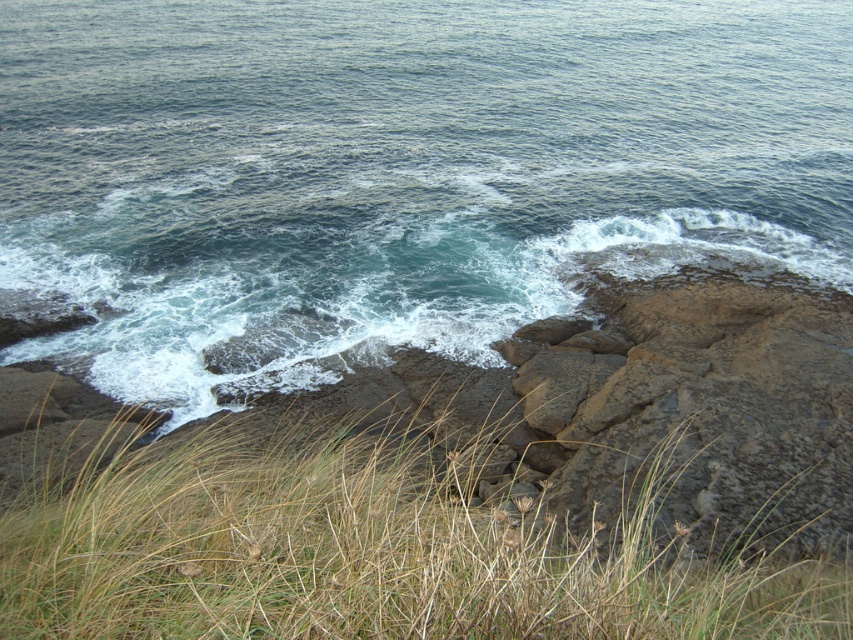
Based on the coordinates given, which object in the scene is located at point (397, 170)?

The point (397, 170) indicates blue water at center.

You are standing at the edge of the rugged rocky coastline and notice the blue water at center and the brown grass at lower center. Which of these two elements appears taller from your viewpoint?

The blue water at center appears taller than the brown grass at lower center from your viewpoint.

You are standing at the rugged rocky terrain in the middle ground of the coastal scene. You want to reach the blue water at center. Which direction should you move to get there?

The blue water at center is located at point (397, 170), so you should move towards the center of the image to reach it.